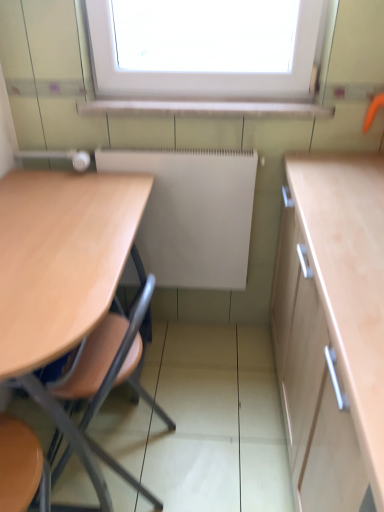
What do you see at coordinates (193, 214) in the screenshot?
I see `white matte radiator at center` at bounding box center [193, 214].

Find the location of a particular element. white matte radiator at center is located at coordinates (193, 214).

Describe the element at coordinates (61, 275) in the screenshot. I see `light wood table at left` at that location.

Image resolution: width=384 pixels, height=512 pixels. I want to click on light wood table at left, so click(x=61, y=275).

This screenshot has width=384, height=512. I want to click on white matte radiator at center, so click(x=193, y=214).

Can you confirm if white matte radiator at center is positioned to the right of light wood table at left?

Correct, you'll find white matte radiator at center to the right of light wood table at left.

Does white matte radiator at center lie behind light wood table at left?

Yes, the depth of white matte radiator at center is greater than that of light wood table at left.

Considering the points (203, 181) and (57, 295), which point is in front, point (203, 181) or point (57, 295)?

Positioned in front is point (57, 295).

From the image's perspective, is white matte radiator at center positioned above or below light wood table at left?

white matte radiator at center is situated higher than light wood table at left in the image.

From a real-world perspective, is white matte radiator at center beneath light wood table at left?

No, from a real-world perspective, white matte radiator at center is not below light wood table at left.

Between white matte radiator at center and light wood table at left, which one has larger width?

light wood table at left is wider.

Looking at this image, considering the relative sizes of white matte radiator at center and light wood table at left in the image provided, is white matte radiator at center taller than light wood table at left?

No.

Looking at the image, does white matte radiator at center seem bigger or smaller compared to light wood table at left?

In the image, white matte radiator at center appears to be smaller than light wood table at left.

Is light wood table at left completely or partially inside white matte radiator at center?

No, light wood table at left is not inside white matte radiator at center.

Is white matte radiator at center beside light wood table at left?

No.

Is light wood table at left at the back of white matte radiator at center?

No, white matte radiator at center is not facing away from light wood table at left.

Can you tell me how much white matte radiator at center and light wood table at left differ in facing direction?

white matte radiator at center and light wood table at left are facing 89.7 degrees away from each other.

Measure the distance between white matte radiator at center and light wood table at left.

14.40 inches.

This screenshot has width=384, height=512. What are the coordinates of `table that is on the left side of white matte radiator at center` in the screenshot? It's located at (61, 275).

Can you confirm if light wood table at left is positioned to the left of white matte radiator at center?

Yes, light wood table at left is to the left of white matte radiator at center.

In the image, is light wood table at left positioned in front of or behind white matte radiator at center?

Visually, light wood table at left is located in front of white matte radiator at center.

Between point (70, 240) and point (229, 207), which one is positioned in front?

The point (70, 240) is more forward.

From the image's perspective, is light wood table at left located above white matte radiator at center?

Actually, light wood table at left appears below white matte radiator at center in the image.

From a real-world perspective, is light wood table at left positioned over white matte radiator at center based on gravity?

No, from a real-world perspective, light wood table at left is not on top of white matte radiator at center.

Considering the relative sizes of light wood table at left and white matte radiator at center in the image provided, is light wood table at left thinner than white matte radiator at center?

Incorrect, the width of light wood table at left is not less than that of white matte radiator at center.

Considering the relative sizes of light wood table at left and white matte radiator at center in the image provided, is light wood table at left shorter than white matte radiator at center?

No, light wood table at left is not shorter than white matte radiator at center.

Is light wood table at left smaller than white matte radiator at center?

No, light wood table at left is not smaller than white matte radiator at center.

From the picture: Would you say light wood table at left contains white matte radiator at center?

Definitely not — white matte radiator at center is not inside light wood table at left.

Is light wood table at left next to white matte radiator at center and touching it?

They are not placed beside each other.

Is light wood table at left facing towards white matte radiator at center?

No, light wood table at left is not facing towards white matte radiator at center.

How many degrees apart are the facing directions of light wood table at left and white matte radiator at center?

The facing directions of light wood table at left and white matte radiator at center are 89.7 degrees apart.

How far apart are light wood table at left and white matte radiator at center?

light wood table at left and white matte radiator at center are 14.40 inches apart from each other.

Locate an element on the screen. Image resolution: width=384 pixels, height=512 pixels. radiator on the right of light wood table at left is located at coordinates (193, 214).

Where is `radiator behind the light wood table at left`? radiator behind the light wood table at left is located at coordinates (193, 214).

You are a GUI agent. You are given a task and a screenshot of the screen. Output one action in this format:
    pyautogui.click(x=<x>, y=<y>)
    Task: Click on the radiator on the right side of light wood table at left
    
    Given the screenshot: What is the action you would take?
    pyautogui.click(x=193, y=214)